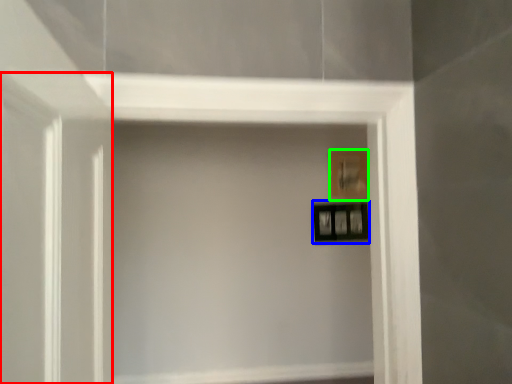
Question: Considering the real-world distances, which object is farthest from glass door (highlighted by a red box)? picture frame (highlighted by a blue box) or picture frame (highlighted by a green box)?

Choices:
 (A) picture frame
 (B) picture frame

Answer: (B)